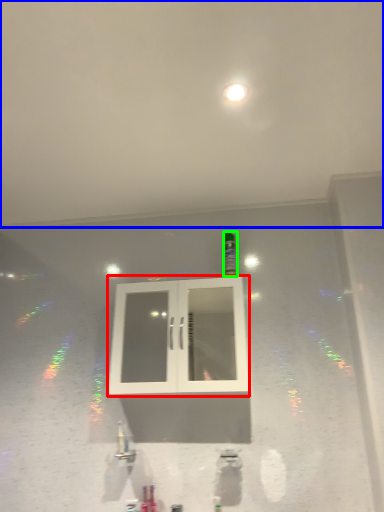
Question: Which object is the closest to the window (highlighted by a red box)? Choose among these: backdrop (highlighted by a blue box) or bottle (highlighted by a green box).

Choices:
 (A) backdrop
 (B) bottle

Answer: (B)